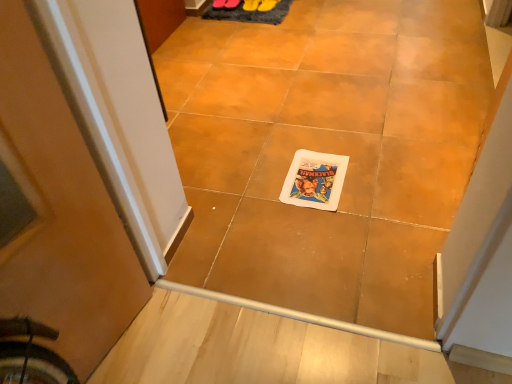
Question: In the image, is yellow rubber boot at center, which is counted as the second footwear, starting from the right, positioned in front of or behind dark gray shaggy rug at upper center?

Choices:
 (A) behind
 (B) front

Answer: (A)

Question: In terms of height, does yellow rubber boot at center, the 1th footwear viewed from the left, look taller or shorter compared to dark gray shaggy rug at upper center?

Choices:
 (A) tall
 (B) short

Answer: (B)

Question: Estimate the real-world distances between objects in this image. Which object is closer to the yellow rubber boot at center, which is counted as the second footwear, starting from the right?

Choices:
 (A) rubber yellow shoe at upper center, the 1th footwear when ordered from right to left
 (B) matte paper comic book at center
 (C) dark gray shaggy rug at upper center
 (D) white matte tile at center

Answer: (A)

Question: Which of these objects is positioned closest to the yellow rubber boot at center, which is counted as the second footwear, starting from the right?

Choices:
 (A) dark gray shaggy rug at upper center
 (B) white matte tile at center
 (C) matte paper comic book at center
 (D) rubber yellow shoe at upper center, the 1th footwear when ordered from right to left

Answer: (D)